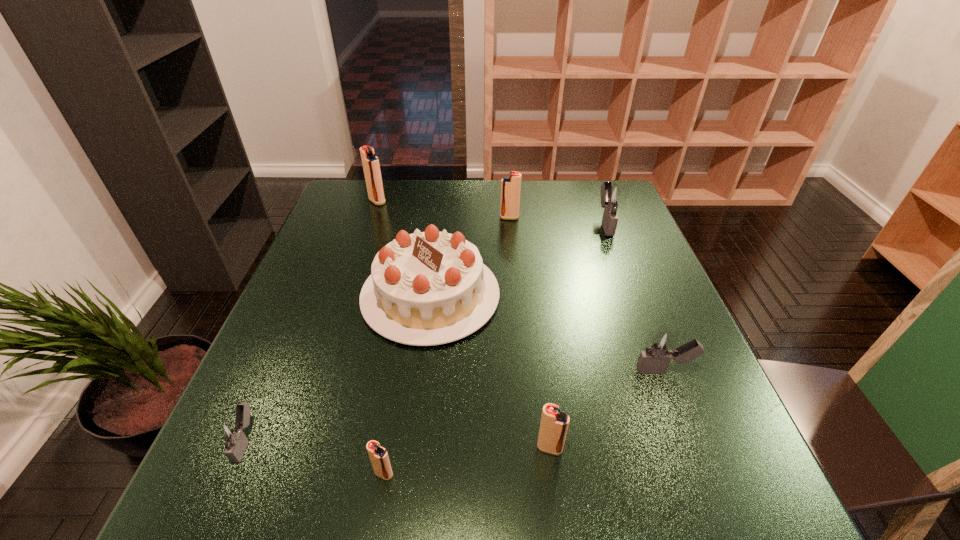
Locate an element on the screen. The width and height of the screenshot is (960, 540). the leftmost object is located at coordinates coord(230,435).

The width and height of the screenshot is (960, 540). In order to click on the nearest gray igniter in this screenshot , I will do `click(230, 435)`.

At what (x,y) coordinates should I click in order to perform the action: click on free spot located on the right of the farthest red igniter. Please return your answer as a coordinate pair (x, y). Looking at the image, I should click on (444, 201).

Where is `free space located 0.080m on the front of the second biggest red igniter`? This screenshot has width=960, height=540. free space located 0.080m on the front of the second biggest red igniter is located at coordinates (511, 237).

This screenshot has height=540, width=960. I want to click on vacant space located 0.130m on the back of the biggest gray igniter, so click(x=592, y=188).

Identify the location of vacant space located on the back of the birthday cake. The width and height of the screenshot is (960, 540). (443, 197).

Find the location of a particular element. free space located 0.080m on the front of the second smallest gray igniter is located at coordinates (684, 420).

The height and width of the screenshot is (540, 960). Identify the location of vacant area situated 0.210m on the back of the third farthest red igniter. (538, 348).

Identify the location of free space located on the right of the nearest object. The image size is (960, 540). (590, 474).

At what (x,y) coordinates should I click in order to perform the action: click on free space located on the right of the leftmost object. Please return your answer as a coordinate pair (x, y). Looking at the image, I should click on (440, 441).